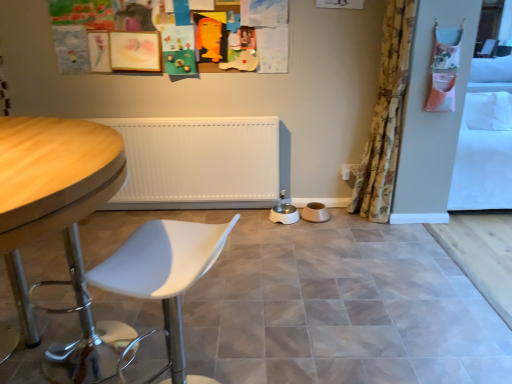
Locate an element on the screen. This screenshot has width=512, height=384. matte ceramic tile at center is located at coordinates (340, 308).

This screenshot has height=384, width=512. What do you see at coordinates (61, 214) in the screenshot?
I see `wooden table at left` at bounding box center [61, 214].

You are a GUI agent. You are given a task and a screenshot of the screen. Output one action in this format:
    pyautogui.click(x=<x>, y=<y>)
    Task: Click on the matte ceramic tile at center
    
    Given the screenshot: What is the action you would take?
    pyautogui.click(x=340, y=308)

From a real-world perspective, which object rests below the other?

From a 3D spatial view, white plastic swivel chair at lower left is below.

Considering the relative sizes of white plastic swivel chair at lower left and floral fabric curtain at right in the image provided, is white plastic swivel chair at lower left smaller than floral fabric curtain at right?

Yes, white plastic swivel chair at lower left is smaller than floral fabric curtain at right.

In order to click on curtain above the white plastic swivel chair at lower left (from the image's perspective) in this screenshot , I will do `click(385, 116)`.

Does white plastic swivel chair at lower left appear on the right side of floral fabric curtain at right?

No.

Is wooden table at left oriented towards matte ceramic tile at center?

No, wooden table at left is not aimed at matte ceramic tile at center.

Considering the positions of objects wooden table at left and matte ceramic tile at center in the image provided, who is more to the left, wooden table at left or matte ceramic tile at center?

From the viewer's perspective, wooden table at left appears more on the left side.

From a real-world perspective, who is located lower, wooden table at left or matte ceramic tile at center?

matte ceramic tile at center.

Is point (113, 362) positioned before point (217, 271)?

Yes, point (113, 362) is closer to viewer.

From a real-world perspective, between white plastic swivel chair at lower left and matte ceramic tile at center, who is vertically lower?

matte ceramic tile at center is physically lower.

Between white plastic swivel chair at lower left and matte ceramic tile at center, which one has less height?

Standing shorter between the two is matte ceramic tile at center.

Is white plastic swivel chair at lower left aimed at matte ceramic tile at center?

No, white plastic swivel chair at lower left is not turned towards matte ceramic tile at center.

Consider the image. How different are the orientations of white plastic swivel chair at lower left and matte ceramic tile at center in degrees?

white plastic swivel chair at lower left and matte ceramic tile at center are facing 104 degrees away from each other.

Is white fabric screen door at right facing towards wooden table at left?

No.

Is there a large distance between white fabric screen door at right and wooden table at left?

Indeed, white fabric screen door at right is not near wooden table at left.

Is point (439, 124) positioned after point (11, 132)?

Yes, point (439, 124) is behind point (11, 132).

Is matte ceramic tile at center smaller than white plastic swivel chair at lower left?

Actually, matte ceramic tile at center might be larger than white plastic swivel chair at lower left.

Would you say white plastic swivel chair at lower left is part of matte ceramic tile at center's contents?

No, matte ceramic tile at center does not contain white plastic swivel chair at lower left.

Looking at their sizes, would you say matte ceramic tile at center is wider or thinner than white plastic swivel chair at lower left?

In the image, matte ceramic tile at center appears to be wider than white plastic swivel chair at lower left.

In the scene shown: From a real-world perspective, which is physically below, matte ceramic tile at center or white plastic swivel chair at lower left?

From a 3D spatial view, matte ceramic tile at center is below.

Which is correct: floral fabric curtain at right is inside white fabric screen door at right, or outside of it?

floral fabric curtain at right is not inside white fabric screen door at right, it's outside.

Can you see floral fabric curtain at right touching white fabric screen door at right?

They are not placed beside each other.

Does floral fabric curtain at right have a larger size compared to white fabric screen door at right?

No.

This screenshot has width=512, height=384. Find the location of `curtain on the left of white fabric screen door at right`. curtain on the left of white fabric screen door at right is located at coordinates (385, 116).

Could you tell me if floral fabric curtain at right is turned towards white plastic swivel chair at lower left?

No, floral fabric curtain at right is not facing towards white plastic swivel chair at lower left.

Can you confirm if floral fabric curtain at right is smaller than white plastic swivel chair at lower left?

No.

This screenshot has width=512, height=384. Find the location of `curtain that is behind the white plastic swivel chair at lower left`. curtain that is behind the white plastic swivel chair at lower left is located at coordinates (385, 116).

The height and width of the screenshot is (384, 512). I want to click on swivel chair on the left of floral fabric curtain at right, so click(x=164, y=275).

Identify the location of ceramic tile that appears behind the wooden table at left. This screenshot has height=384, width=512. (340, 308).

When comparing their distances from matte ceramic tile at center, does floral fabric curtain at right or wooden table at left seem closer?

The object closer to matte ceramic tile at center is wooden table at left.

Based on their spatial positions, is white plastic swivel chair at lower left or matte ceramic tile at center closer to floral fabric curtain at right?

matte ceramic tile at center is closer to floral fabric curtain at right.

Which object lies nearer to the anchor point wooden table at left, white plastic swivel chair at lower left or floral fabric curtain at right?

white plastic swivel chair at lower left is closer to wooden table at left.

Estimate the real-world distances between objects in this image. Which object is further from white fabric screen door at right, wooden table at left or floral fabric curtain at right?

wooden table at left is further to white fabric screen door at right.

Looking at the image, which one is located closer to floral fabric curtain at right, wooden table at left or white fabric screen door at right?

Among the two, white fabric screen door at right is located nearer to floral fabric curtain at right.

From the image, which object appears to be farther from wooden table at left, floral fabric curtain at right or white fabric screen door at right?

white fabric screen door at right is positioned further to the anchor wooden table at left.

Based on their spatial positions, is matte ceramic tile at center or white fabric screen door at right further from wooden table at left?

white fabric screen door at right is further to wooden table at left.

When comparing their distances from wooden table at left, does matte ceramic tile at center or white plastic swivel chair at lower left seem further?

Among the two, matte ceramic tile at center is located further to wooden table at left.

You are a GUI agent. You are given a task and a screenshot of the screen. Output one action in this format:
    pyautogui.click(x=<x>, y=<y>)
    Task: Click on the curtain situated between wooden table at left and white fabric screen door at right from left to right
    
    Given the screenshot: What is the action you would take?
    pyautogui.click(x=385, y=116)

Locate an element on the screen. The height and width of the screenshot is (384, 512). curtain between matte ceramic tile at center and white fabric screen door at right from left to right is located at coordinates (385, 116).

You are a GUI agent. You are given a task and a screenshot of the screen. Output one action in this format:
    pyautogui.click(x=<x>, y=<y>)
    Task: Click on the curtain between white plastic swivel chair at lower left and white fabric screen door at right from left to right
    
    Given the screenshot: What is the action you would take?
    pyautogui.click(x=385, y=116)

Find the location of `swivel chair positioned between wooden table at left and floral fabric curtain at right from near to far`. swivel chair positioned between wooden table at left and floral fabric curtain at right from near to far is located at coordinates (164, 275).